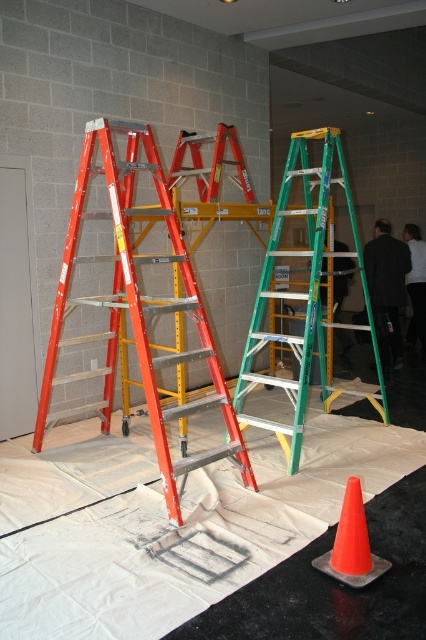
You are a construction worker who needs to move a tool from the green metallic ladder at center to the orange plastic traffic cone at lower right. Can you do this without moving either object, given that the tool requires a minimum of 2 meters of space to be safely transported?

The distance between the green metallic ladder at center and the orange plastic traffic cone at lower right is 1.85 meters, which is less than the required 2 meters. Therefore, the tool cannot be safely transported without moving either object.

You are an inspector checking the placement of ladders in a construction area. You see a point marked at coordinates (x=137, y=308). What object does this point correspond to?

The point at coordinates (x=137, y=308) corresponds to the orange fiberglass ladder at left.

You are a construction worker who needs to retrieve a tool from a shelf that is 10 feet away from the camera. You see the orange fiberglass ladder at left. Can you use this ladder to reach the shelf?

The orange fiberglass ladder at left is 9.96 feet away from camera, so it is close enough to reach the shelf that is 10 feet away. Yes, you can use the orange fiberglass ladder at left to reach the shelf.